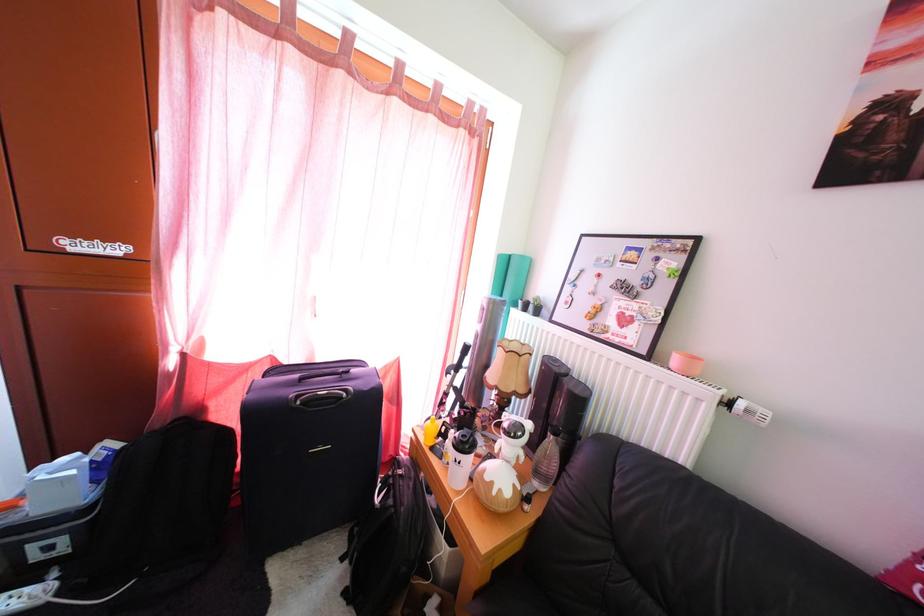
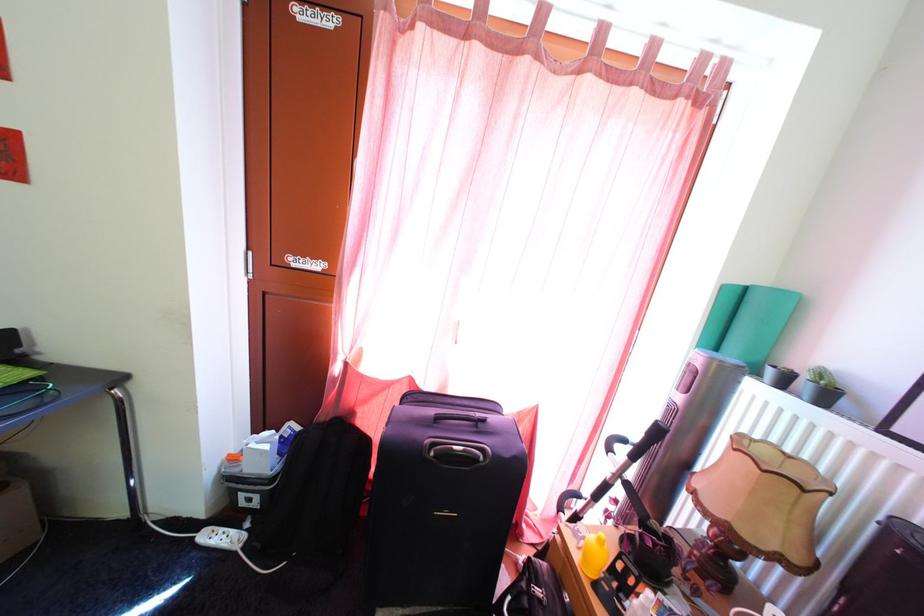
Which direction would the cameraman need to move to produce the second image?

The cameraman moved toward left, forward.